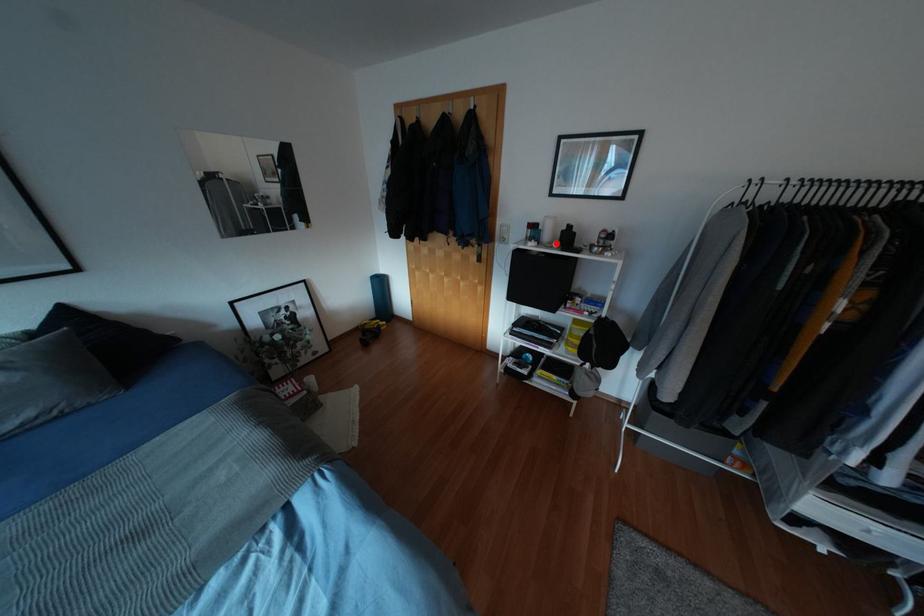
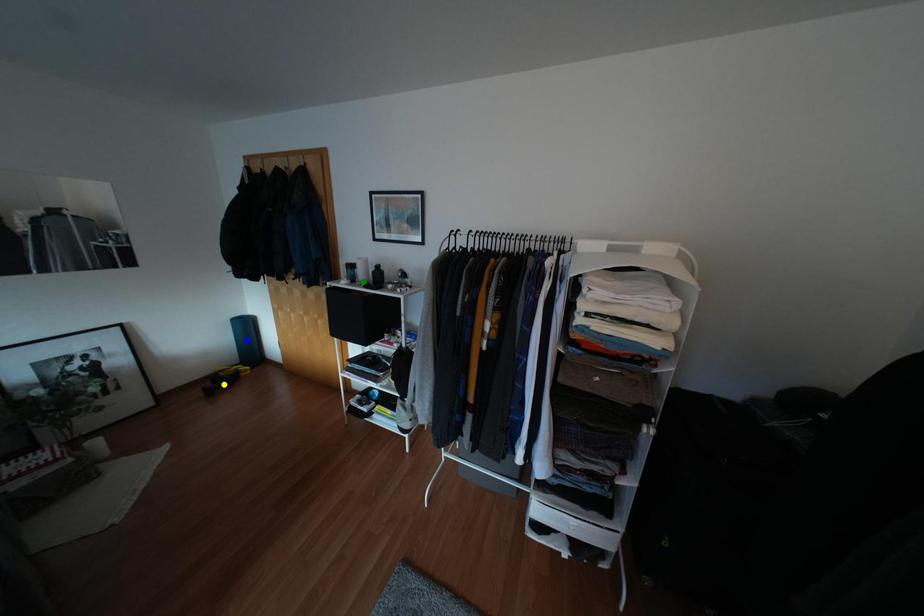
Question: I am providing you with two images of the same scene from different viewpoints. A red point is marked on the first image. You are given multiple points on the second image. In image 2, which mark is for the same physical point as the one in image 1?

Choices:
 (A) green point
 (B) blue point
 (C) yellow point

Answer: (A)